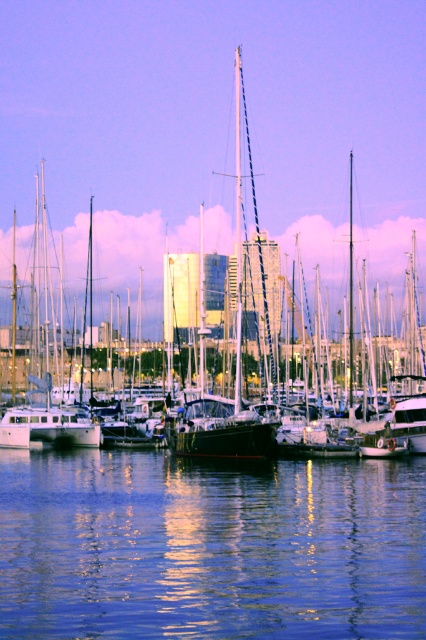
Based on the photo, you are standing at the edge of the marina and notice a point in the water. Which object is located at the coordinates point (210, 547)?

The blue reflective water at center is located at point (210, 547).

You are standing at the edge of the marina and want to know if the blue reflective water at center is wider than the shiny black sailboat at center. Can you determine this based on the scene?

The blue reflective water at center is thinner than the shiny black sailboat at center, so it is not wider than the sailboat.

You are standing at the edge of the marina and notice the blue reflective water at center. Can you determine its exact location using the coordinate system provided?

The blue reflective water at center is located at point (210, 547).